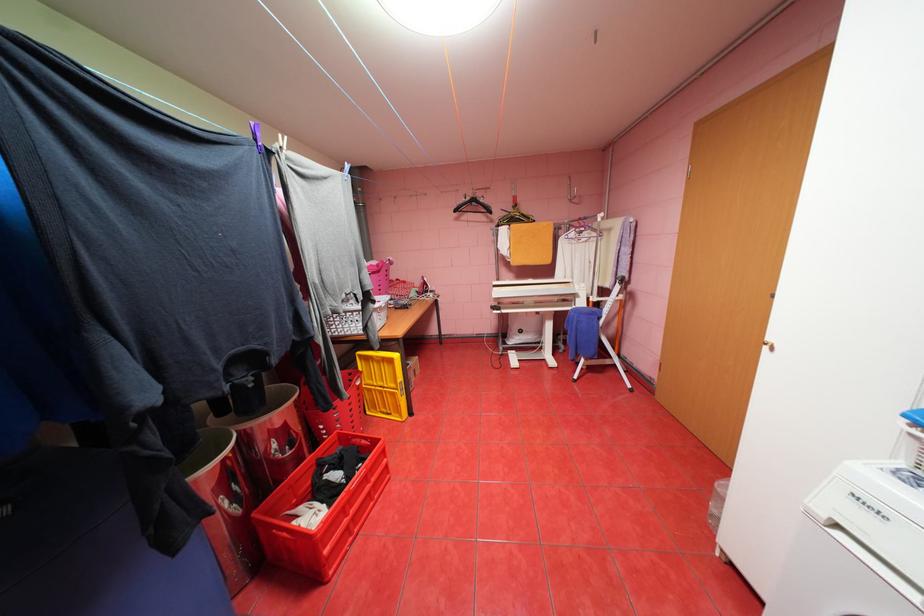
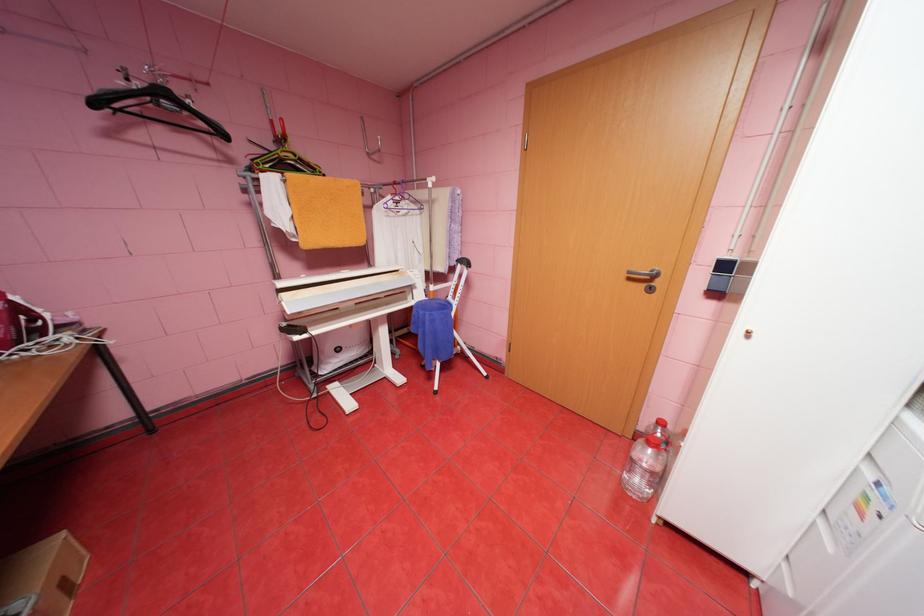
The point at (x=433, y=283) is marked in the first image. Where is the corresponding point in the second image?

(26, 309)